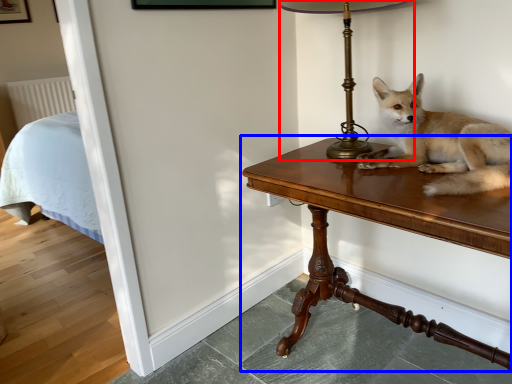
Question: Which object is closer to the camera taking this photo, table lamp (highlighted by a red box) or table (highlighted by a blue box)?

Choices:
 (A) table lamp
 (B) table

Answer: (B)